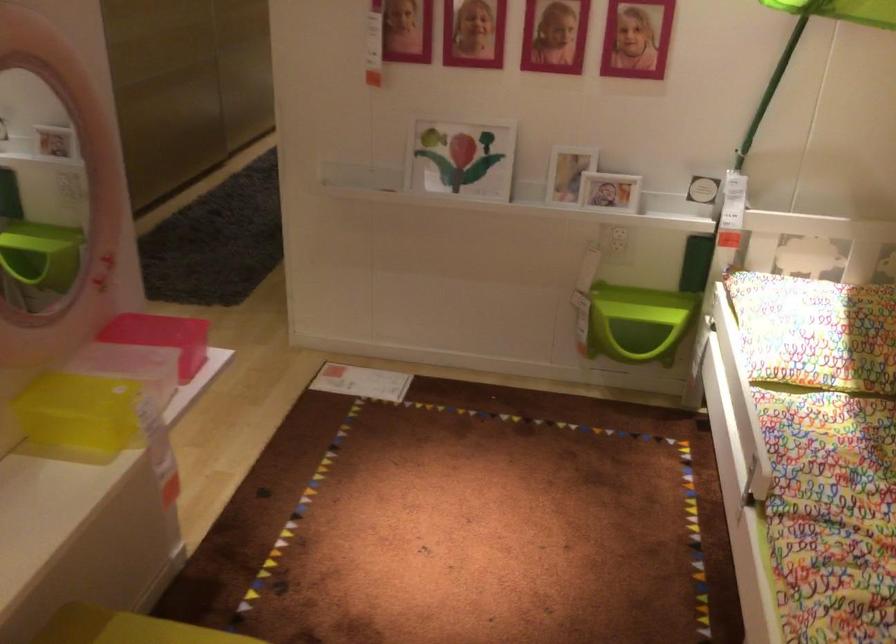
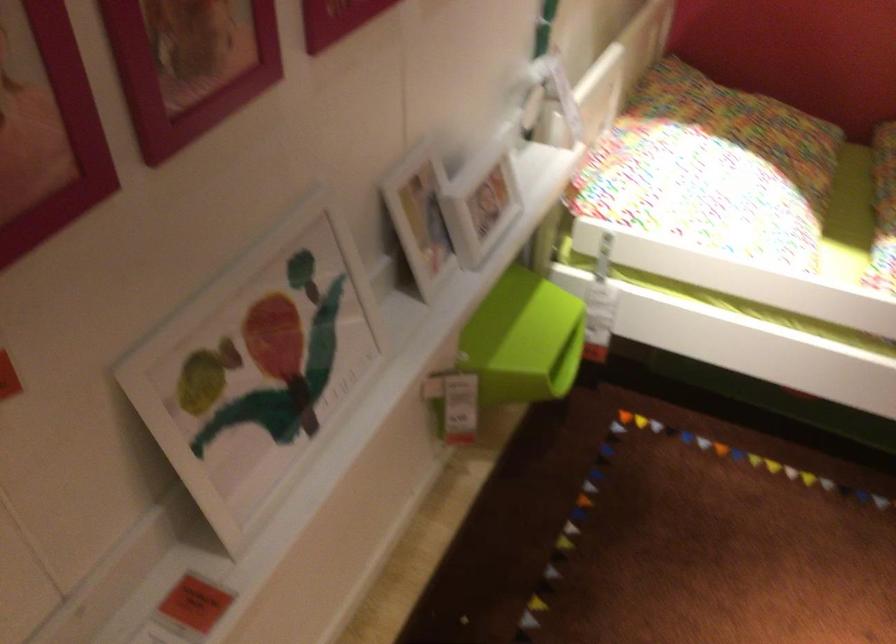
Find the pixel in the second image that matches (x=632, y=308) in the first image.

(522, 339)